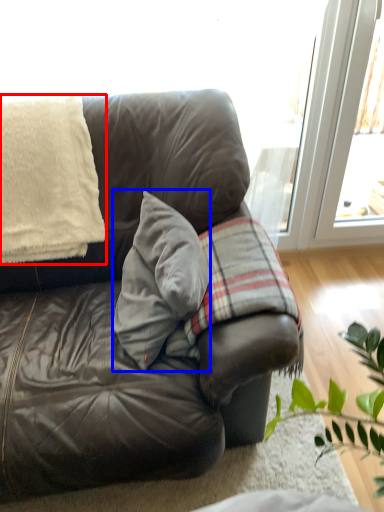
Question: Among these objects, which one is farthest to the camera, blanket (highlighted by a red box) or throw pillow (highlighted by a blue box)?

Choices:
 (A) blanket
 (B) throw pillow

Answer: (A)